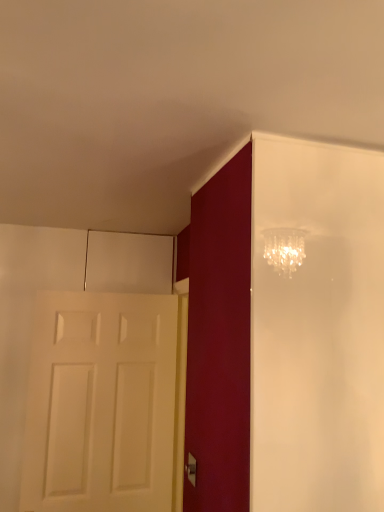
Question: Considering the positions of point (188, 474) and point (127, 479), is point (188, 474) closer or farther from the camera than point (127, 479)?

Choices:
 (A) closer
 (B) farther

Answer: (A)

Question: Choose the correct answer: Is silver metallic door handle at lower center inside white matte door at left or outside it?

Choices:
 (A) outside
 (B) inside

Answer: (A)

Question: In the image, is silver metallic door handle at lower center on the left side or the right side of white matte door at left?

Choices:
 (A) right
 (B) left

Answer: (A)

Question: In terms of height, does white matte door at left look taller or shorter compared to silver metallic door handle at lower center?

Choices:
 (A) short
 (B) tall

Answer: (B)

Question: Considering their positions, is white matte door at left located in front of or behind silver metallic door handle at lower center?

Choices:
 (A) front
 (B) behind

Answer: (B)

Question: Is white matte door at left wider or thinner than silver metallic door handle at lower center?

Choices:
 (A) wide
 (B) thin

Answer: (A)

Question: Is white matte door at left inside or outside of silver metallic door handle at lower center?

Choices:
 (A) outside
 (B) inside

Answer: (A)